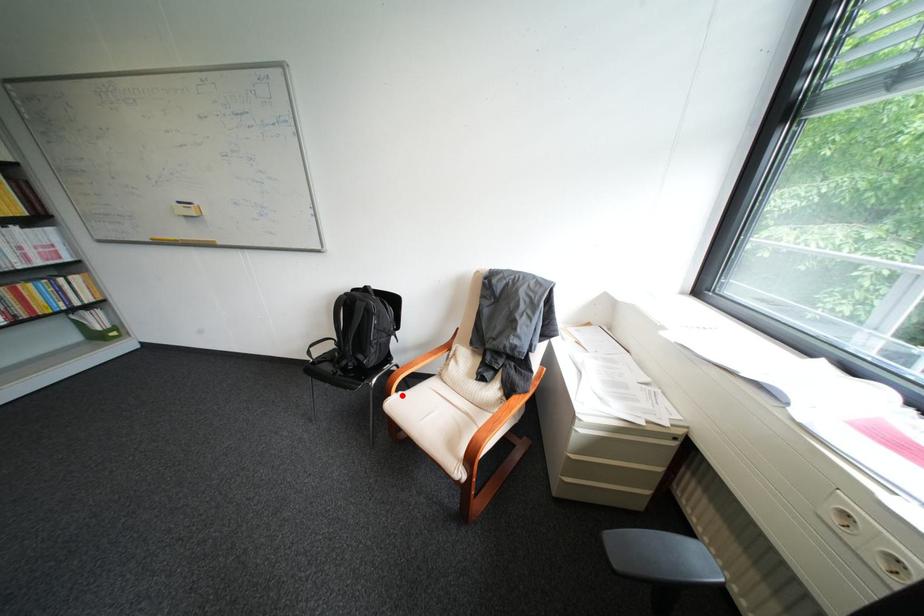
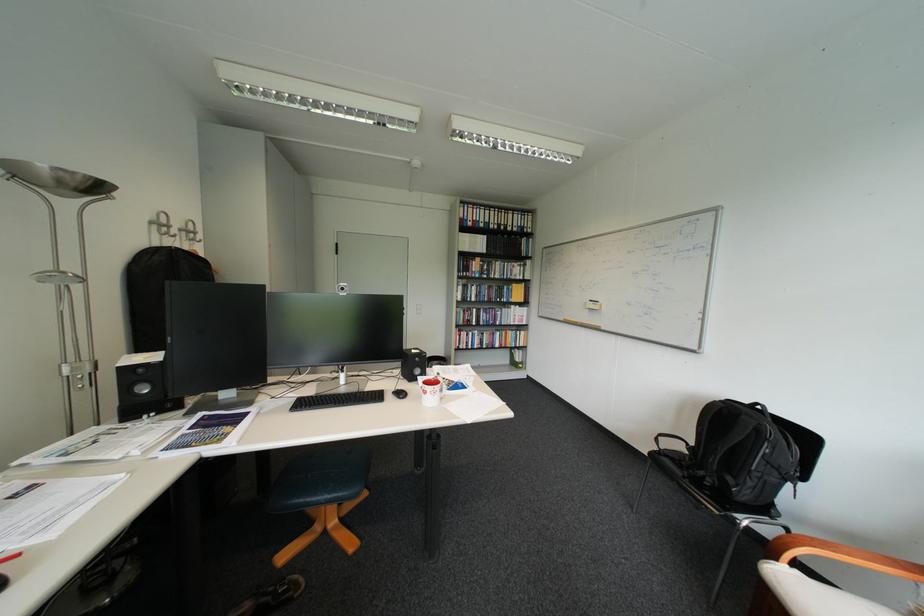
Find the pixel in the second image that matches the highlighted location in the first image.

(788, 560)